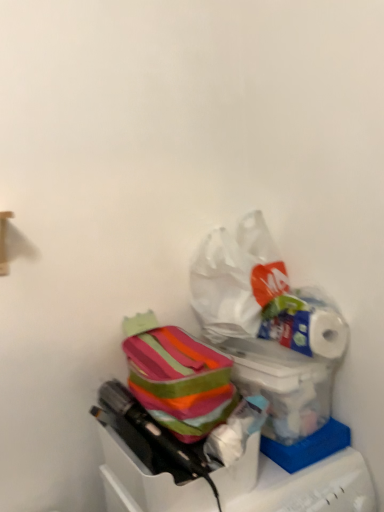
Question: In terms of height, does translucent plastic bag at lower right, the 2th box when ordered from bottom to top, look taller or shorter compared to striped fabric lunchbox at center?

Choices:
 (A) short
 (B) tall

Answer: (A)

Question: Which is correct: translucent plastic bag at lower right, the 2th box when ordered from bottom to top, is inside striped fabric lunchbox at center, or outside of it?

Choices:
 (A) outside
 (B) inside

Answer: (A)

Question: Estimate the real-world distances between objects in this image. Which object is closer to the white plastic bag at upper center?

Choices:
 (A) white glossy toilet paper at upper right
 (B) striped fabric bag at center, which is the 2th box in top-to-bottom order
 (C) striped fabric lunchbox at center
 (D) translucent plastic bag at lower right, the 1th box in the top-to-bottom sequence

Answer: (A)

Question: Which is farther from the translucent plastic bag at lower right, the 2th box when ordered from bottom to top?

Choices:
 (A) white plastic bag at upper center
 (B) white glossy toilet paper at upper right
 (C) striped fabric bag at center, which is the 2th box in top-to-bottom order
 (D) striped fabric lunchbox at center

Answer: (C)